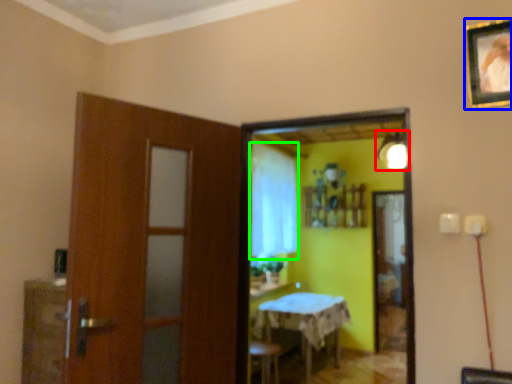
Question: Which object is positioned closest to light fixture (highlighted by a red box)? Select from picture frame (highlighted by a blue box) and curtain (highlighted by a green box).

Choices:
 (A) picture frame
 (B) curtain

Answer: (B)